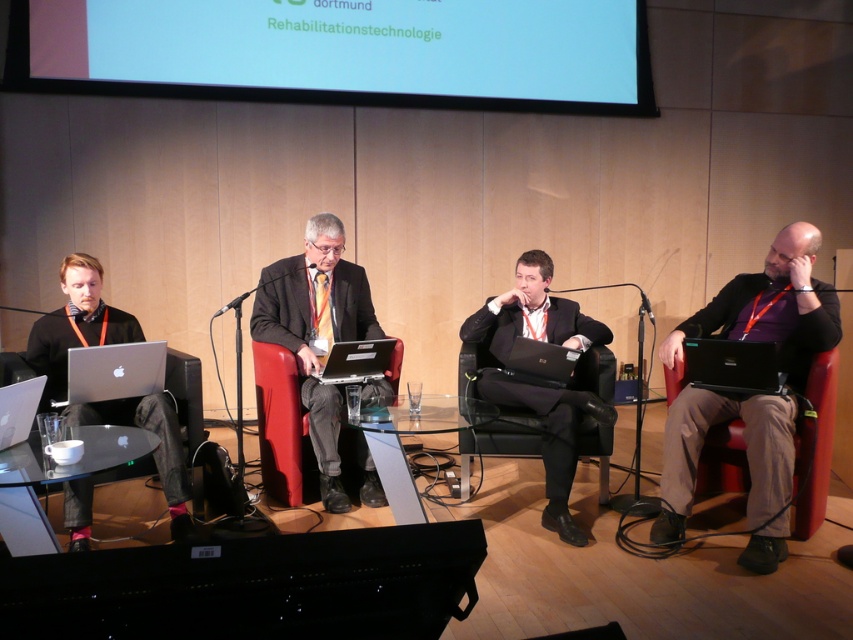
You are a photographer adjusting your camera settings to capture the panel discussion. You need to focus on two specific points in the image labeled as point (x=817, y=362) and point (x=293, y=467). Which of these points is closer to your camera lens?

Point (x=817, y=362) is closer to the camera lens than point (x=293, y=467) according to the description.

You are sitting in the red leather chair at center and want to pass a document to the person in the red leather chair at right. Which direction should you pass the document?

Since the red leather chair at right is closer to the viewer than the red leather chair at center, you should pass the document forward towards the red leather chair at right.

You are a stagehand who needs to place a 1.5 meter long banner between the red leather chair at right and the red leather chair at center. Is there enough space for the banner to fit horizontally between them?

The distance between the red leather chair at right and the red leather chair at center is 1.92 meters. Since the banner is 1.5 meters long, it will fit horizontally between them with 0.42 meters of space remaining.